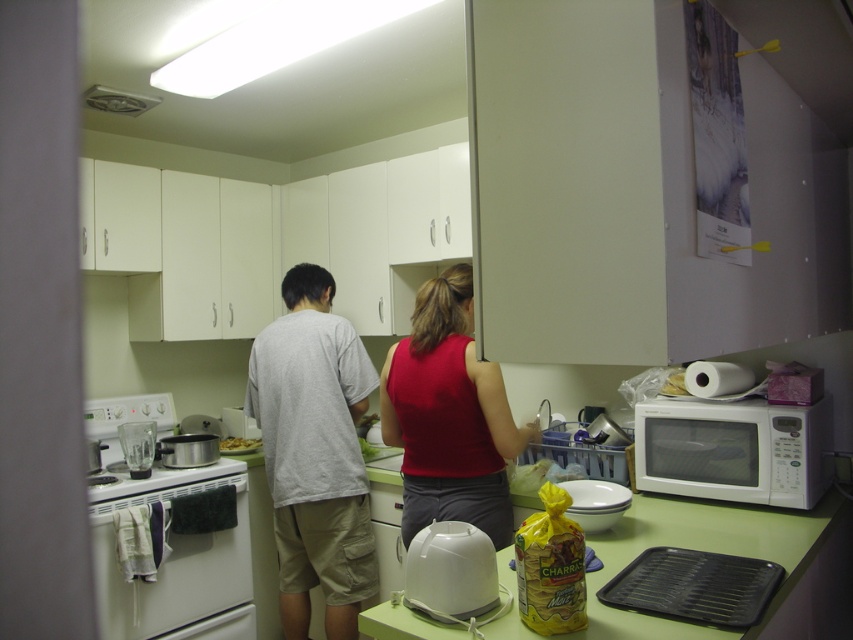
Question: Which object appears farthest from the camera in this image?

Choices:
 (A) shiny silver pot at center
 (B) white plastic plate at center
 (C) gray cotton t-shirt at center
 (D) matte gray shirt at center

Answer: (A)

Question: Does matte gray shirt at center appear under white matte microwave at right?

Choices:
 (A) yes
 (B) no

Answer: (B)

Question: Is gray cotton t-shirt at center above white matte microwave at right?

Choices:
 (A) yes
 (B) no

Answer: (B)

Question: Which of the following is the closest to the observer?

Choices:
 (A) matte gray shirt at center
 (B) white plastic plate at center
 (C) shiny silver pot at center
 (D) gray cotton t-shirt at center

Answer: (A)

Question: Which object is the farthest from the gray cotton t-shirt at center?

Choices:
 (A) green matte counter top at center
 (B) matte gray shirt at center
 (C) shiny silver pot at center
 (D) white glossy oven at lower left

Answer: (A)

Question: Can you confirm if white plastic toaster at lower center is bigger than shiny silver pot at center?

Choices:
 (A) yes
 (B) no

Answer: (A)